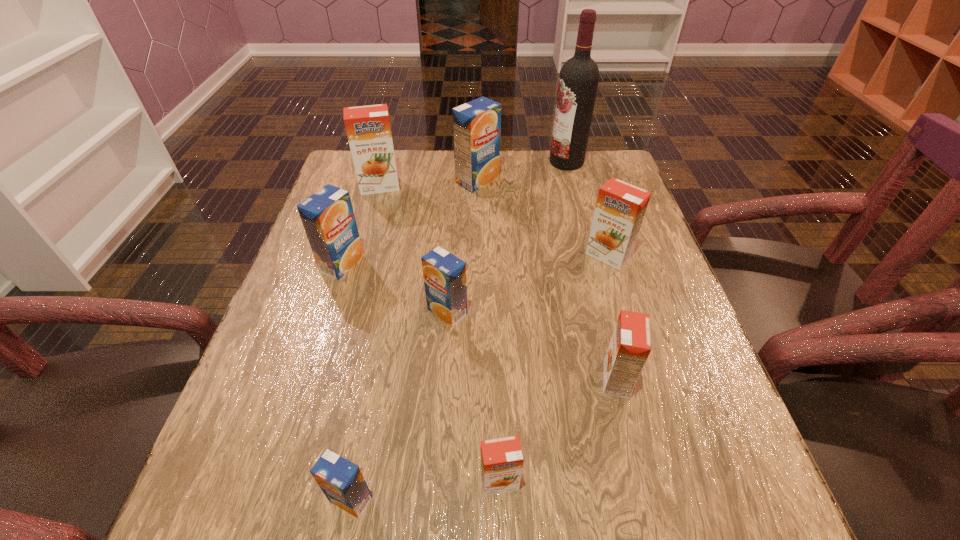
The height and width of the screenshot is (540, 960). I want to click on orange juice that can be found as the closest to the third nearest blue orange_juice, so click(x=444, y=274).

Choose which blue orange_juice is the second nearest neighbor to the farthest orange orange juice. Please provide its 2D coordinates. Your answer should be formatted as a tuple, i.e. [(x, y)], where the tuple contains the x and y coordinates of a point satisfying the conditions above.

[(328, 218)]

You are a GUI agent. You are given a task and a screenshot of the screen. Output one action in this format:
    pyautogui.click(x=<x>, y=<y>)
    Task: Click on the closest blue orange_juice to the second biggest blue orange_juice
    The height and width of the screenshot is (540, 960).
    Given the screenshot: What is the action you would take?
    pyautogui.click(x=444, y=274)

You are a GUI agent. You are given a task and a screenshot of the screen. Output one action in this format:
    pyautogui.click(x=<x>, y=<y>)
    Task: Click on the closest orange orange juice relative to the wine bottle
    
    Given the screenshot: What is the action you would take?
    tap(620, 208)

Locate an element on the screen. The width and height of the screenshot is (960, 540). orange orange juice that stands as the second closest to the third nearest object is located at coordinates (620, 208).

The height and width of the screenshot is (540, 960). Identify the location of blank area in the image that satisfies the following two spatial constraints: 1. on the label of the wine bottle; 2. on the front side of the farthest orange orange juice. (573, 186).

Locate an element on the screen. free space that satisfies the following two spatial constraints: 1. on the back side of the fourth nearest object; 2. on the right side of the smallest blue orange_juice is located at coordinates (387, 312).